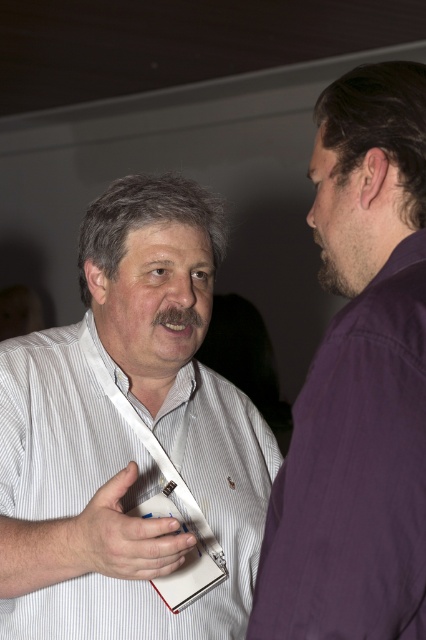
Question: In this image, where is white striped shirt at center located relative to purple cotton shirt at right?

Choices:
 (A) left
 (B) right

Answer: (A)

Question: Does purple cotton shirt at right have a greater width compared to white paper at center?

Choices:
 (A) no
 (B) yes

Answer: (A)

Question: Is purple cotton shirt at right above white paper at center?

Choices:
 (A) no
 (B) yes

Answer: (B)

Question: Which point is farther from the camera taking this photo?

Choices:
 (A) (376, 348)
 (B) (78, 548)
 (C) (114, 444)

Answer: (C)

Question: Which of the following is the closest to the observer?

Choices:
 (A) (95, 468)
 (B) (420, 516)

Answer: (B)

Question: Which object appears farthest from the camera in this image?

Choices:
 (A) purple cotton shirt at right
 (B) white paper at center

Answer: (B)